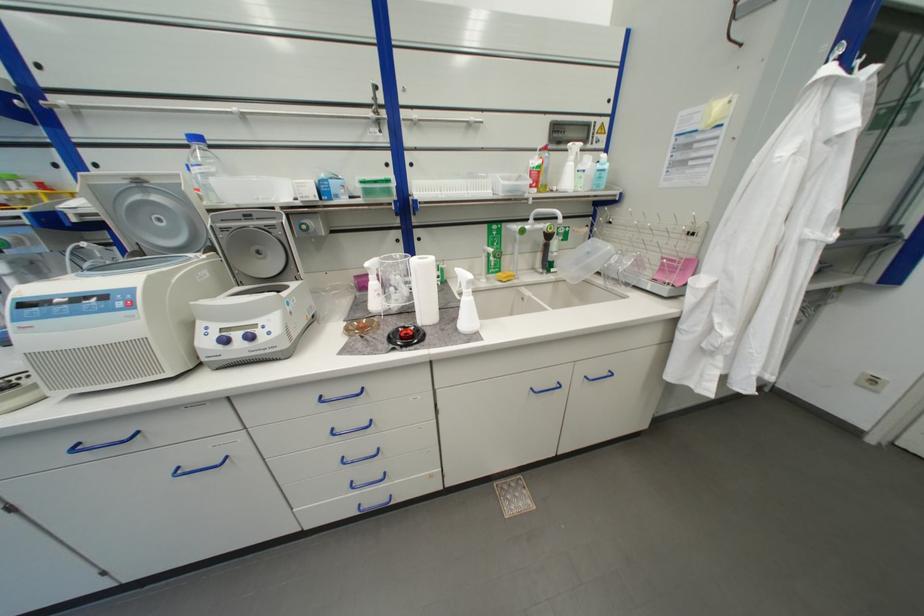
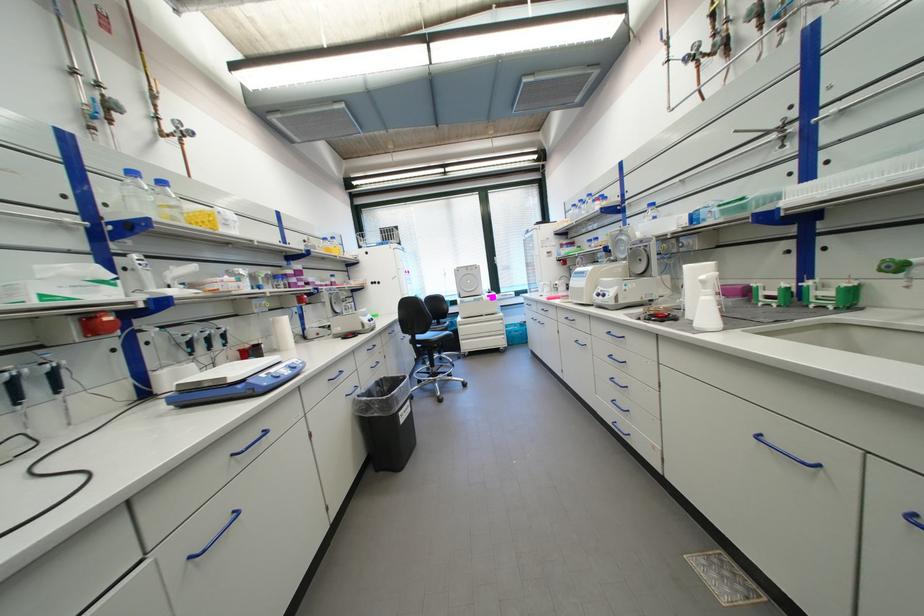
The point at (x=408, y=347) is marked in the first image. Where is the corresponding point in the second image?

(655, 321)